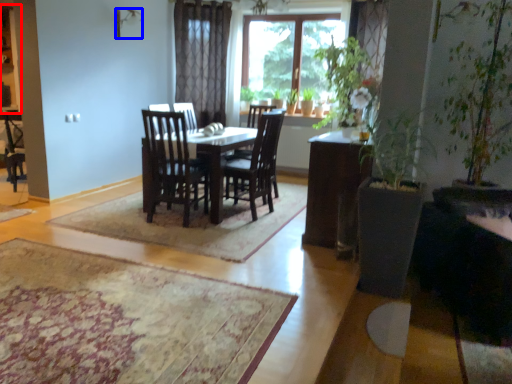
Question: Among these objects, which one is nearest to the camera, cabinetry (highlighted by a red box) or lamp (highlighted by a blue box)?

Choices:
 (A) cabinetry
 (B) lamp

Answer: (B)